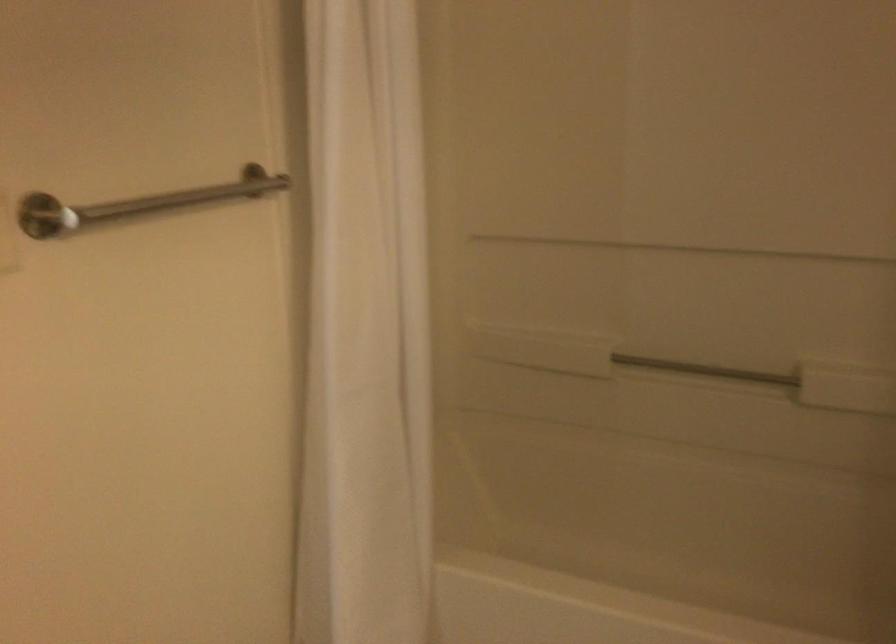
Find where to grabb the metal grab bar. Please return your answer as a coordinate pair (x, y).

(138, 204)